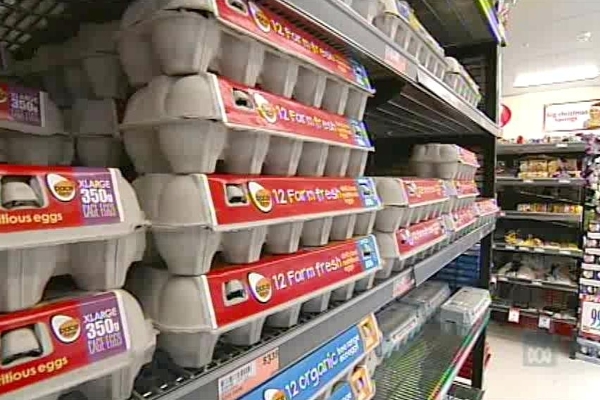
The width and height of the screenshot is (600, 400). Identify the location of metal grating for shelving. (158, 385), (410, 376), (32, 18).